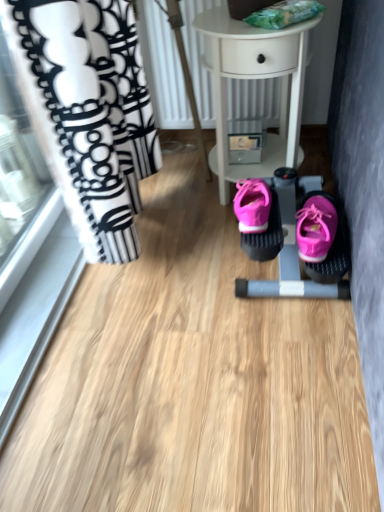
Where is `vacant space that is to the left of white glossy table at center`? vacant space that is to the left of white glossy table at center is located at coordinates (175, 204).